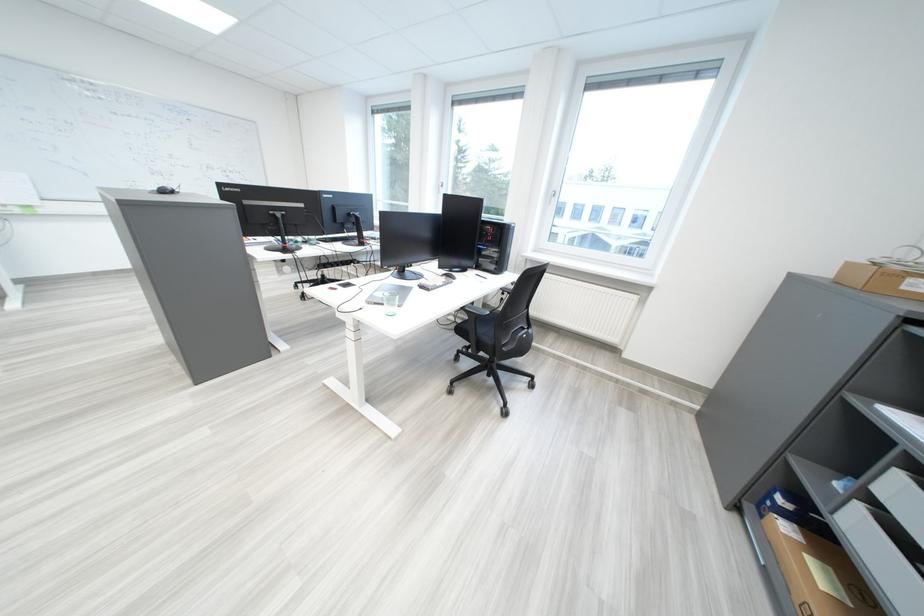
Identify the location of glass cup. Image resolution: width=924 pixels, height=616 pixels. (390, 302).